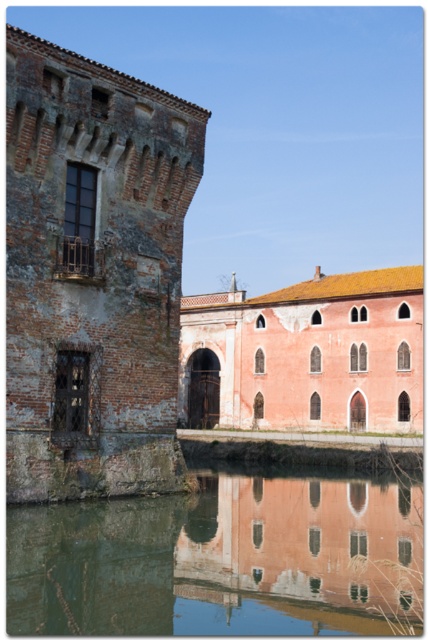
Question: Observing the image, what is the correct spatial positioning of brick wall tower at left in reference to greenish reflective water at lower center?

Choices:
 (A) above
 (B) below

Answer: (A)

Question: Can you confirm if brick wall tower at left is positioned below greenish reflective water at lower center?

Choices:
 (A) no
 (B) yes

Answer: (A)

Question: Is brick wall tower at left wider than greenish reflective water at lower center?

Choices:
 (A) yes
 (B) no

Answer: (B)

Question: Among these objects, which one is nearest to the camera?

Choices:
 (A) greenish reflective water at lower center
 (B) brick wall tower at left

Answer: (A)

Question: Which point is farther to the camera?

Choices:
 (A) (14, 596)
 (B) (140, 426)

Answer: (B)